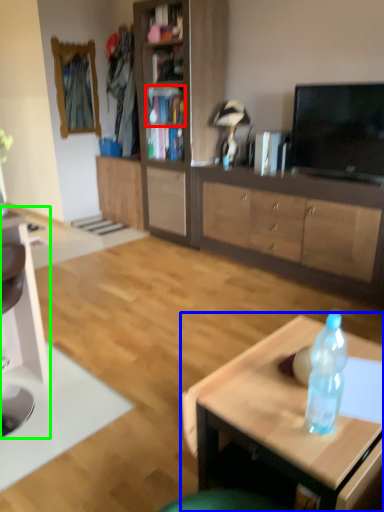
Question: Based on their relative distances, which object is farther from cabinet (highlighted by a red box)? Choose from coffee table (highlighted by a blue box) and computer desk (highlighted by a green box).

Choices:
 (A) coffee table
 (B) computer desk

Answer: (A)